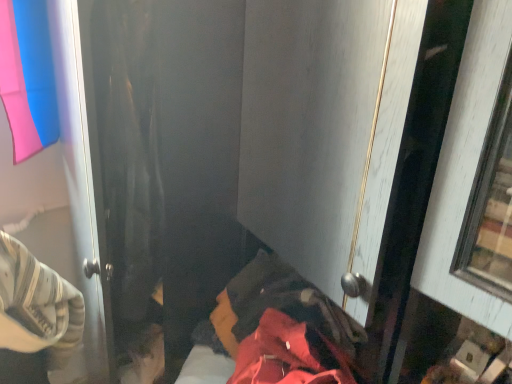
Question: Considering the relative sizes of pink fabric at upper left and red fabric bed at lower center in the image provided, is pink fabric at upper left thinner than red fabric bed at lower center?

Choices:
 (A) yes
 (B) no

Answer: (A)

Question: Is pink fabric at upper left positioned before red fabric bed at lower center?

Choices:
 (A) no
 (B) yes

Answer: (A)

Question: Is pink fabric at upper left next to red fabric bed at lower center?

Choices:
 (A) no
 (B) yes

Answer: (A)

Question: From the image's perspective, is pink fabric at upper left above red fabric bed at lower center?

Choices:
 (A) yes
 (B) no

Answer: (A)

Question: Are pink fabric at upper left and red fabric bed at lower center far apart?

Choices:
 (A) no
 (B) yes

Answer: (A)

Question: Is pink fabric at upper left to the right of red fabric bed at lower center from the viewer's perspective?

Choices:
 (A) yes
 (B) no

Answer: (B)

Question: Does red fabric bed at lower center have a greater height compared to pink fabric at upper left?

Choices:
 (A) no
 (B) yes

Answer: (A)

Question: Is red fabric bed at lower center positioned beyond the bounds of pink fabric at upper left?

Choices:
 (A) yes
 (B) no

Answer: (A)

Question: Considering the relative sizes of red fabric bed at lower center and pink fabric at upper left in the image provided, is red fabric bed at lower center bigger than pink fabric at upper left?

Choices:
 (A) yes
 (B) no

Answer: (A)

Question: Does red fabric bed at lower center have a lesser height compared to pink fabric at upper left?

Choices:
 (A) no
 (B) yes

Answer: (B)

Question: Is pink fabric at upper left surrounded by red fabric bed at lower center?

Choices:
 (A) no
 (B) yes

Answer: (A)

Question: Is red fabric bed at lower center turned away from pink fabric at upper left?

Choices:
 (A) yes
 (B) no

Answer: (B)

Question: In terms of width, does pink fabric at upper left look wider or thinner when compared to red fabric bed at lower center?

Choices:
 (A) wide
 (B) thin

Answer: (B)